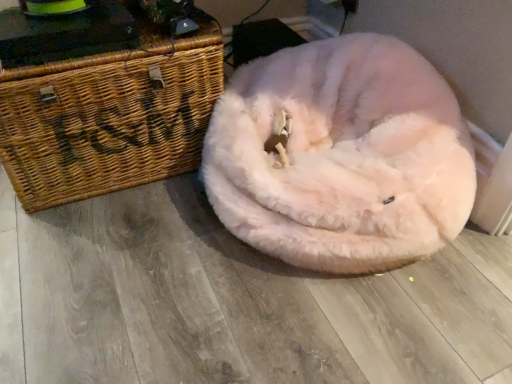
Where is `free space in front of woven wood chest at left`? Image resolution: width=512 pixels, height=384 pixels. free space in front of woven wood chest at left is located at coordinates (123, 272).